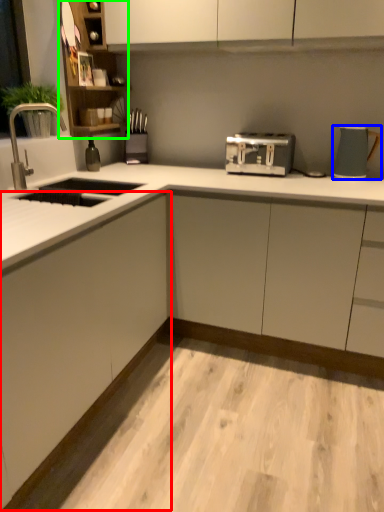
Question: Which object is the farthest from cabinetry (highlighted by a red box)? Choose among these: kitchen appliance (highlighted by a blue box) or cabinet (highlighted by a green box).

Choices:
 (A) kitchen appliance
 (B) cabinet

Answer: (A)